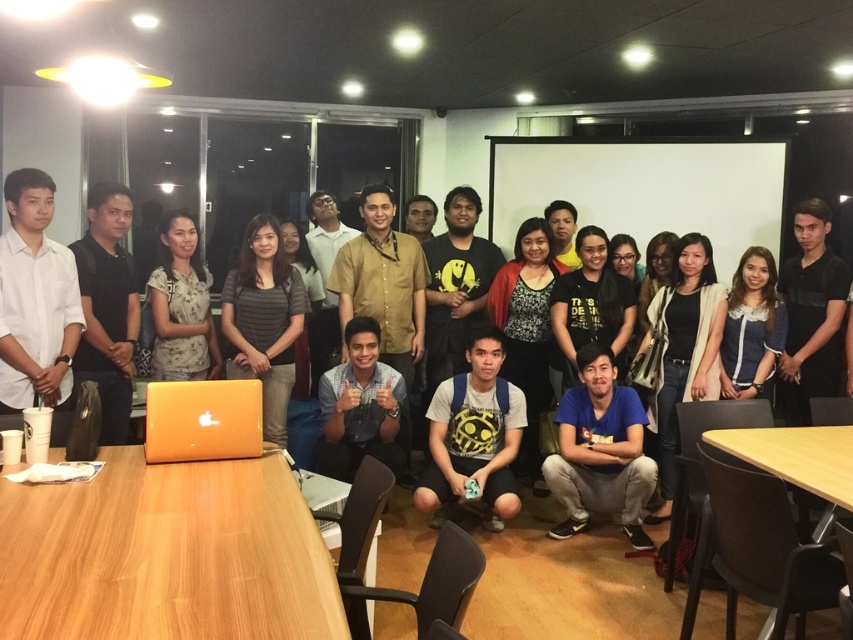
You are a person who is 5.5 feet tall. You are standing at the black matte shirt at center and want to reach the light brown wooden table at lower right. Can you comfortably reach the table without stretching?

The light brown wooden table at lower right is 4.39 feet away from the black matte shirt at center. Since the distance is less than your height, you can comfortably reach the table without stretching.

You are a photographer standing at the back of the room. You need to capture a photo of the matte black shirt at left and the light brown wooden table at lower right. Based on their heights, which object will appear larger in the photo?

The matte black shirt at left is taller than the light brown wooden table at lower right, so it will appear larger in the photo.